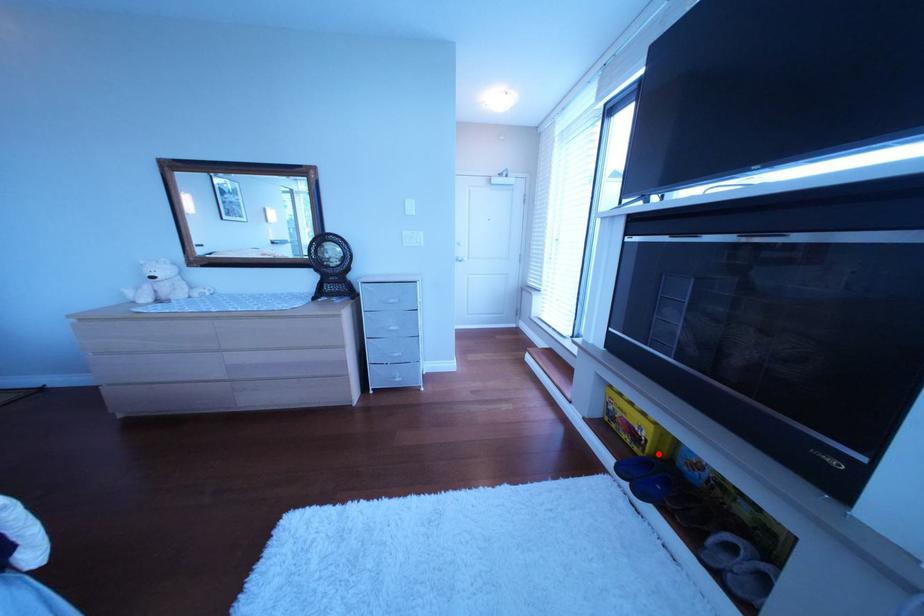
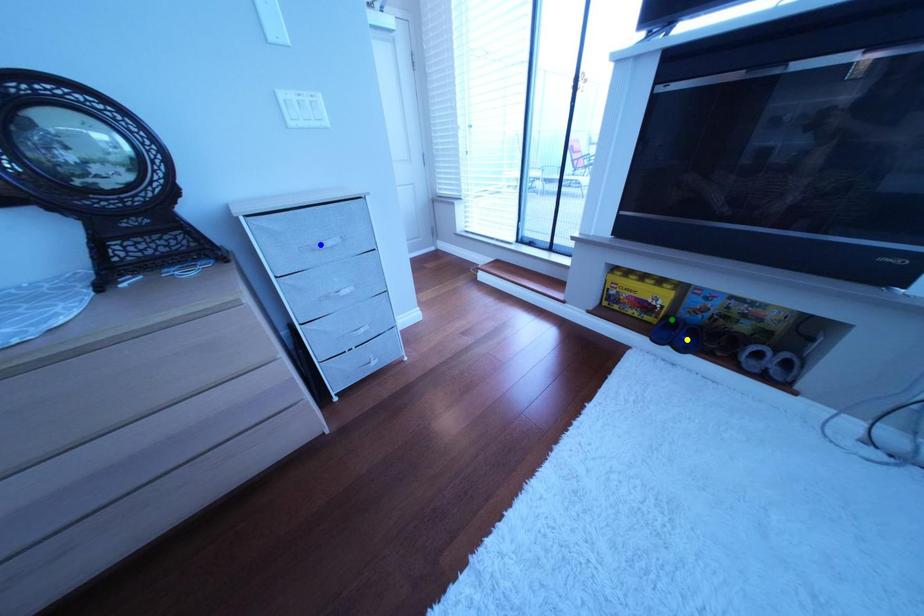
Question: I am providing you with two images of the same scene from different viewpoints. A red point is marked on the first image. You are given multiple points on the second image. Which spot in image 2 lines up with the point in image 1?

Choices:
 (A) blue point
 (B) yellow point
 (C) green point

Answer: (C)